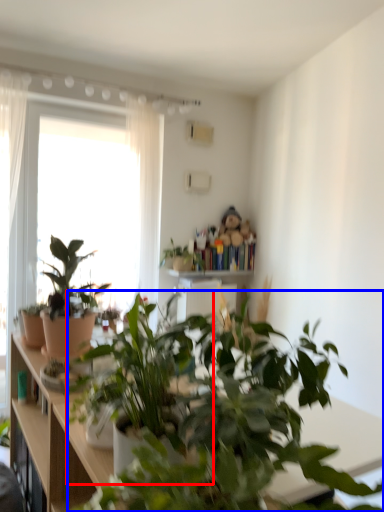
Question: Which point is closer to the camera, houseplant (highlighted by a red box) or houseplant (highlighted by a blue box)?

Choices:
 (A) houseplant
 (B) houseplant

Answer: (A)